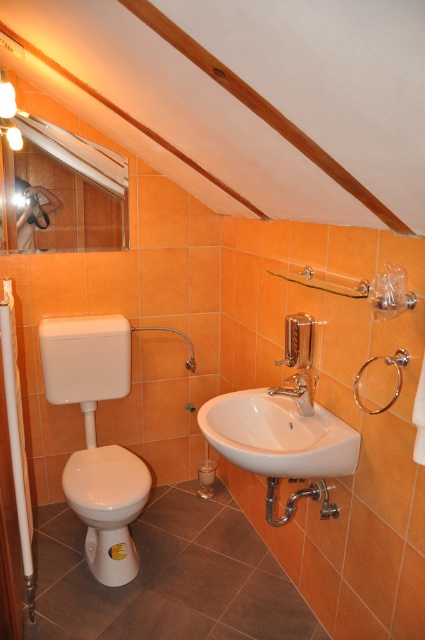
Where is `white glossy sink at center`? This screenshot has height=640, width=425. white glossy sink at center is located at coordinates pos(277,435).

Does point (283, 458) lie in front of point (11, 340)?

That is True.

At what (x,y) coordinates should I click in order to perform the action: click on white glossy sink at center. Please return your answer as a coordinate pair (x, y). The image size is (425, 640). Looking at the image, I should click on (277, 435).

Which is more to the left, white glossy bidet at lower left or white plastic grab bar at left?

Positioned to the left is white plastic grab bar at left.

Looking at this image, is white glossy bidet at lower left below white plastic grab bar at left?

Correct, white glossy bidet at lower left is located below white plastic grab bar at left.

Where is `white glossy bidet at lower left`? white glossy bidet at lower left is located at coordinates (107, 506).

Can you confirm if white glossy sink at center is smaller than polished chrome faucet at center?

Incorrect, white glossy sink at center is not smaller in size than polished chrome faucet at center.

Who is more distant from viewer, [299,452] or [288,384]?

Point [288,384]

Which is in front, point (342, 458) or point (300, 394)?

Point (342, 458) is in front.

Find the location of `white glossy sink at center`. white glossy sink at center is located at coordinates (277, 435).